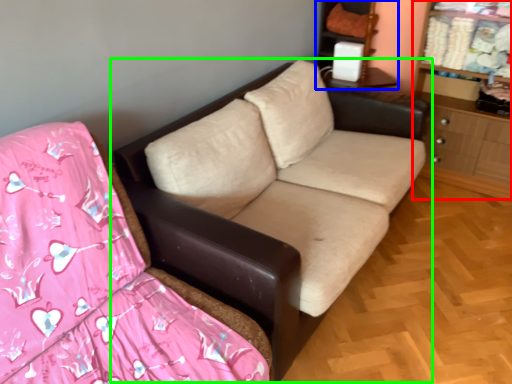
Question: Estimate the real-world distances between objects in this image. Which object is closer to dresser (highlighted by a red box), entertainment center (highlighted by a blue box) or studio couch (highlighted by a green box)?

Choices:
 (A) entertainment center
 (B) studio couch

Answer: (A)